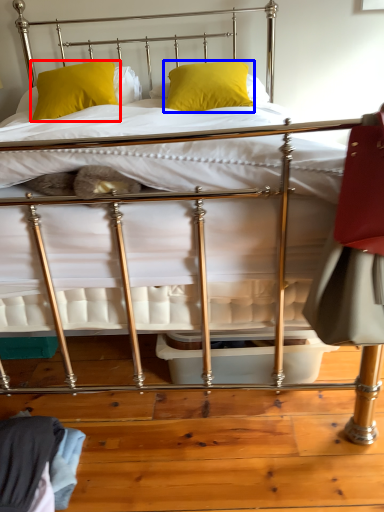
Question: Which object appears farthest to the camera in this image, pillow (highlighted by a red box) or pillow (highlighted by a blue box)?

Choices:
 (A) pillow
 (B) pillow

Answer: (A)